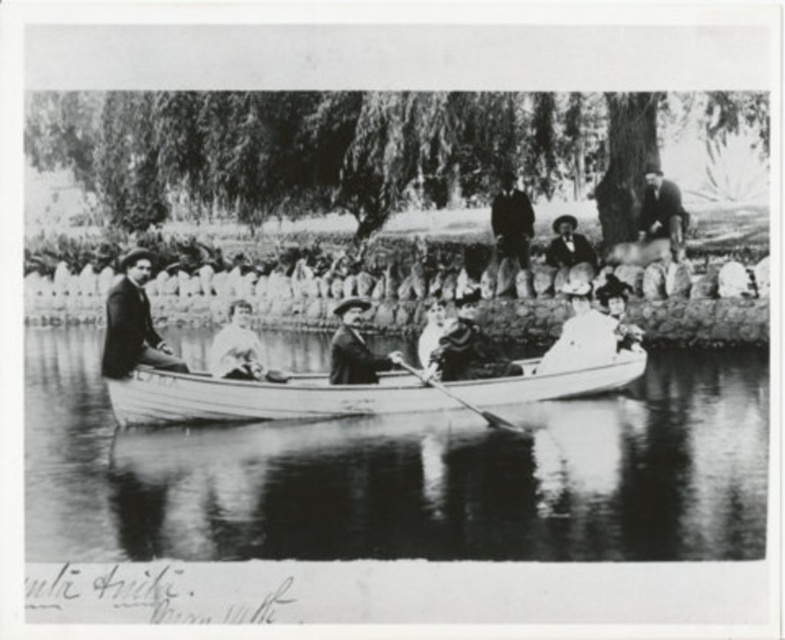
Question: Can you confirm if smooth white canoe at center is smaller than smooth leather jacket at upper right?

Choices:
 (A) no
 (B) yes

Answer: (A)

Question: Which point appears closest to the camera in this image?

Choices:
 (A) (469, 404)
 (B) (217, 403)
 (C) (283, 346)
 (D) (111, 294)

Answer: (B)

Question: Can you confirm if smooth white canoe at center is positioned to the right of smooth leather jacket at upper right?

Choices:
 (A) yes
 (B) no

Answer: (B)

Question: In this image, where is smooth white canoe at center located relative to smooth leather hat at center?

Choices:
 (A) left
 (B) right

Answer: (B)

Question: Among these objects, which one is nearest to the camera?

Choices:
 (A) smooth leather hat at center
 (B) smooth leather jacket at upper right
 (C) smooth white canoe at center

Answer: (C)

Question: Which object is the farthest from the smooth dark suit at left?

Choices:
 (A) smooth leather jacket at upper right
 (B) smooth white water at center
 (C) wooden polished paddle at center

Answer: (A)